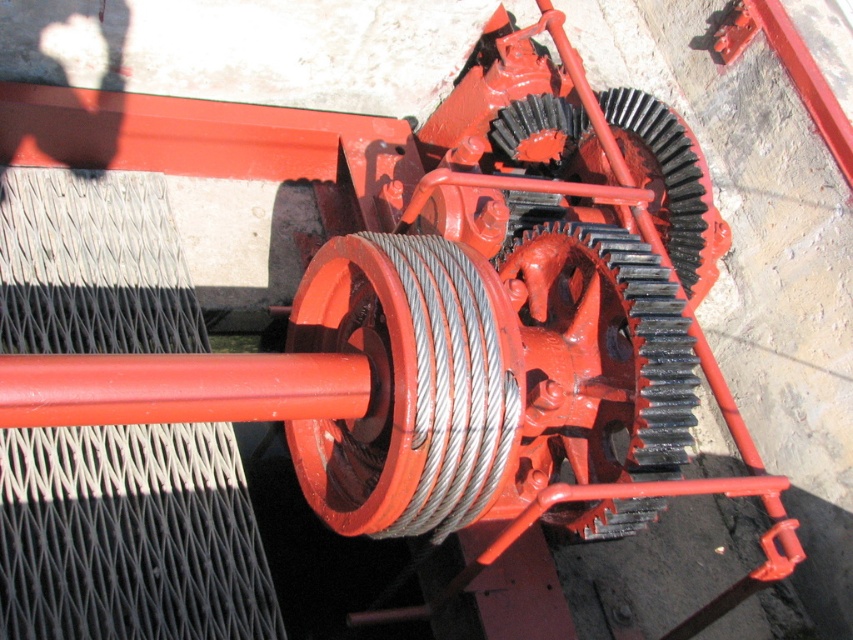
Question: Is matte orange pulley at center positioned before metallic wire at center?

Choices:
 (A) no
 (B) yes

Answer: (B)

Question: Which point appears closest to the camera in this image?

Choices:
 (A) (540, 237)
 (B) (457, 452)

Answer: (B)

Question: Which point appears closest to the camera in this image?

Choices:
 (A) (560, 264)
 (B) (392, 468)

Answer: (B)

Question: Does matte orange pulley at center appear under metallic wire at center?

Choices:
 (A) no
 (B) yes

Answer: (B)

Question: Does matte orange pulley at center appear under metallic wire at center?

Choices:
 (A) yes
 (B) no

Answer: (A)